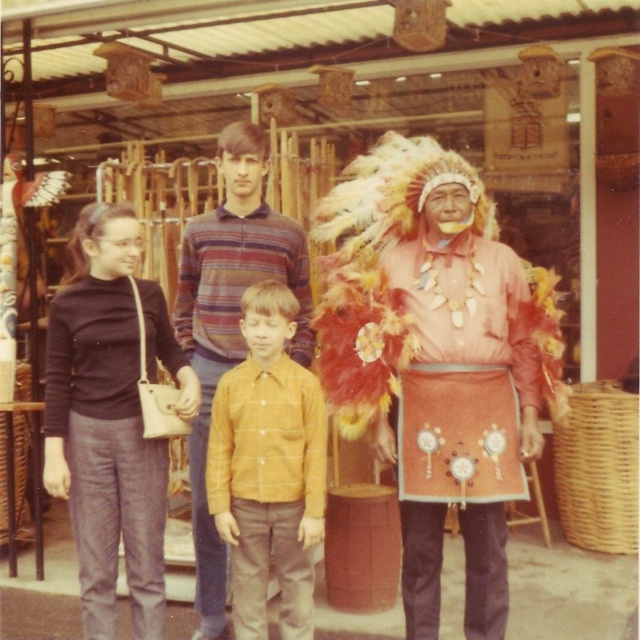
You are a photographer trying to capture a group photo of the matte orange shirt at center and the dark brown fabric pants at left. Since you want to ensure both subjects are in focus, you need to know which one is taller. Can you tell me which is taller?

The matte orange shirt at center is taller than the dark brown fabric pants at left.

You are a photographer trying to capture a clear shot of the matte orange shirt at center and the yellow checkered shirt at center. Which one is closer to the camera?

The matte orange shirt at center is in front of the yellow checkered shirt at center, so it is closer to the camera.

From the picture: You are a tailor who needs to determine which item requires more fabric to make between the dark brown fabric pants at left and the yellow checkered shirt at center. Based on the provided information, which one would need more fabric?

The dark brown fabric pants at left is larger in size than the yellow checkered shirt at center, so it would require more fabric to make.